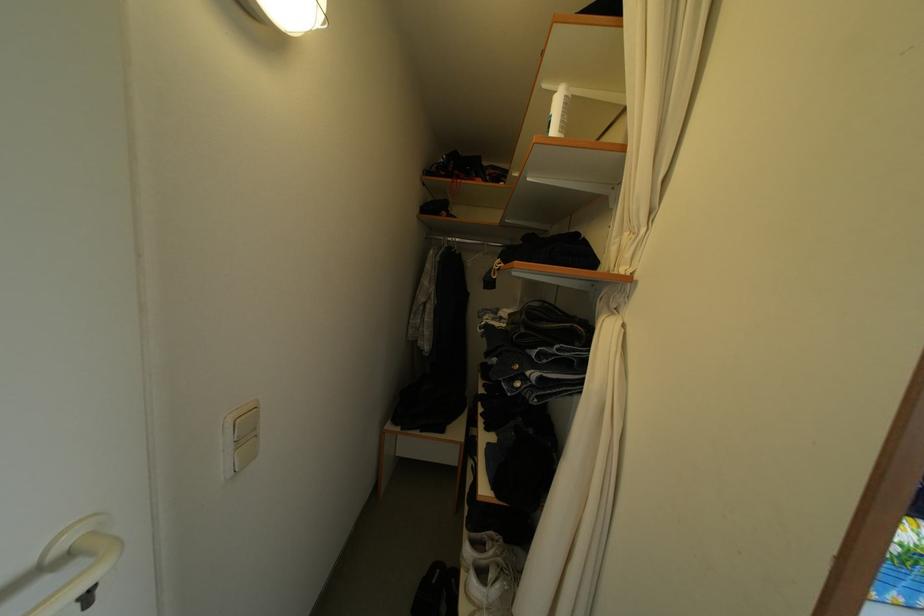
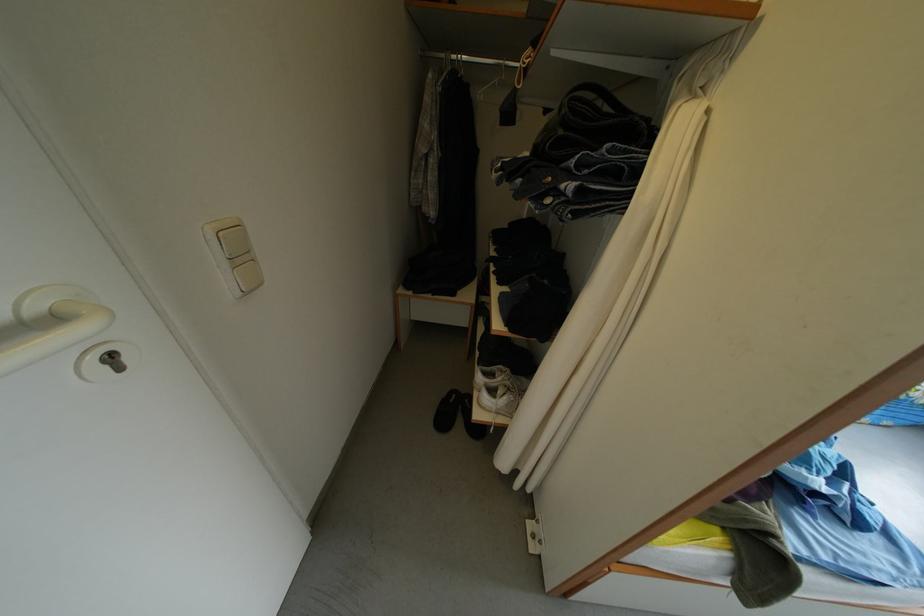
In the second image, find the point that corresponds to point (68, 560) in the first image.

(43, 317)